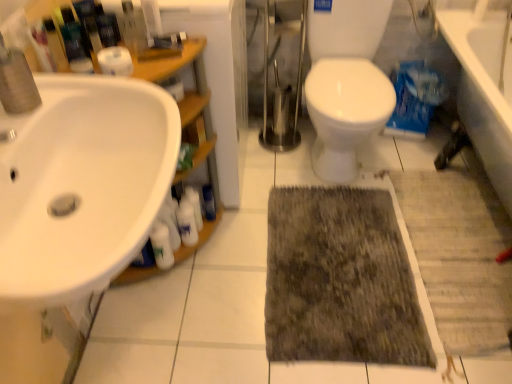
Where is `spots to the right of white glossy bottle at lower left, which appears as the second cleaning product when viewed from the left`? spots to the right of white glossy bottle at lower left, which appears as the second cleaning product when viewed from the left is located at coordinates (233, 257).